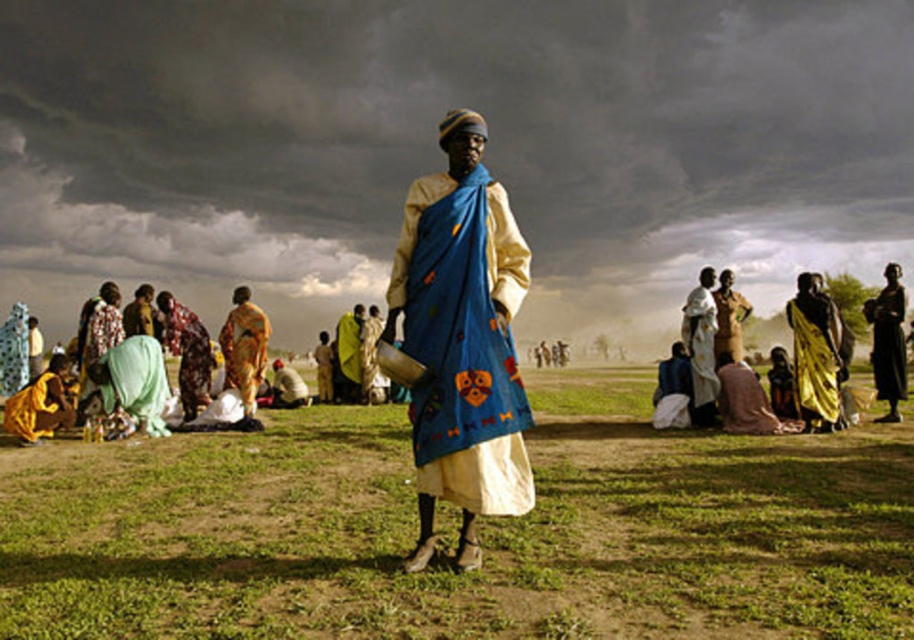
Can you confirm if blue fabric cloth at center is shorter than matte yellow fabric at center?

In fact, blue fabric cloth at center may be taller than matte yellow fabric at center.

Is blue fabric cloth at center below matte yellow fabric at center?

Correct, blue fabric cloth at center is located below matte yellow fabric at center.

Which is behind, point (711, 326) or point (149, 320)?

Point (149, 320)

The image size is (914, 640). Identify the location of blue fabric cloth at center. (700, 348).

Who is higher up, green grass at center or yellow-orange fabric at center?

Positioned higher is yellow-orange fabric at center.

Describe the element at coordinates (482, 532) in the screenshot. The width and height of the screenshot is (914, 640). I see `green grass at center` at that location.

Where is `green grass at center`? green grass at center is located at coordinates (482, 532).

Is point (753, 404) positioned after point (128, 330)?

No.

Is point (732, 397) closer to viewer compared to point (123, 314)?

Yes, point (732, 397) is in front of point (123, 314).

The image size is (914, 640). I want to click on brown textured cloth at lower right, so click(x=742, y=401).